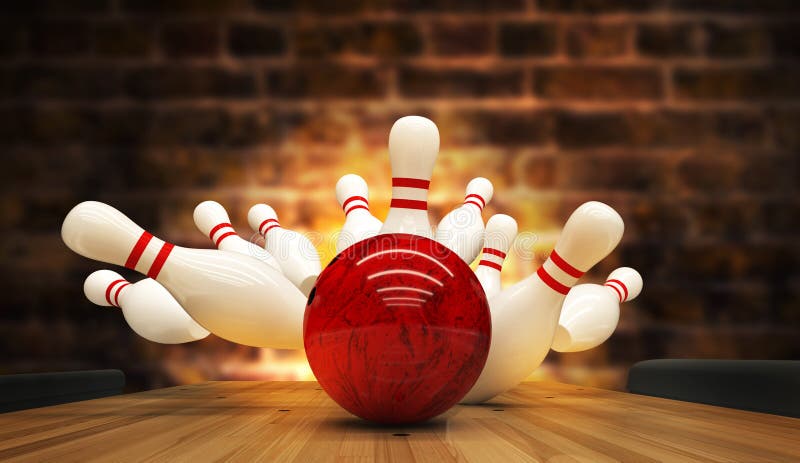
Locate an element on the screen. white tube light reflection is located at coordinates (394, 304), (398, 298), (413, 285), (412, 272), (414, 252).